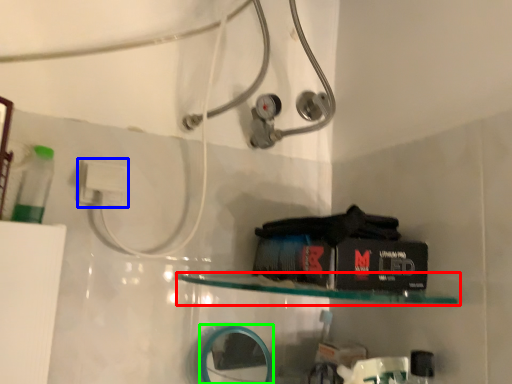
Question: Which object is the closest to the shelf (highlighted by a red box)? Choose among these: electric outlet (highlighted by a blue box) or mirror (highlighted by a green box).

Choices:
 (A) electric outlet
 (B) mirror

Answer: (B)